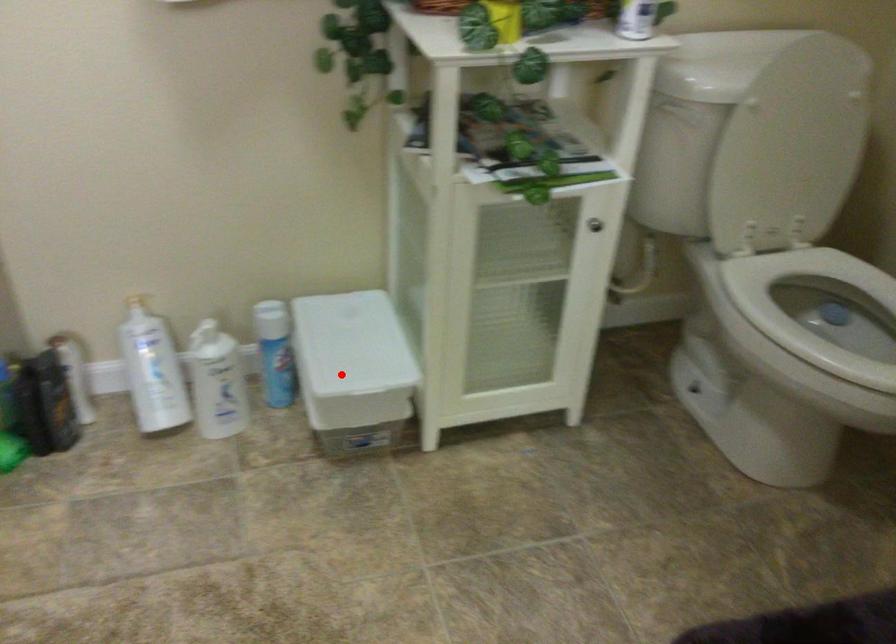
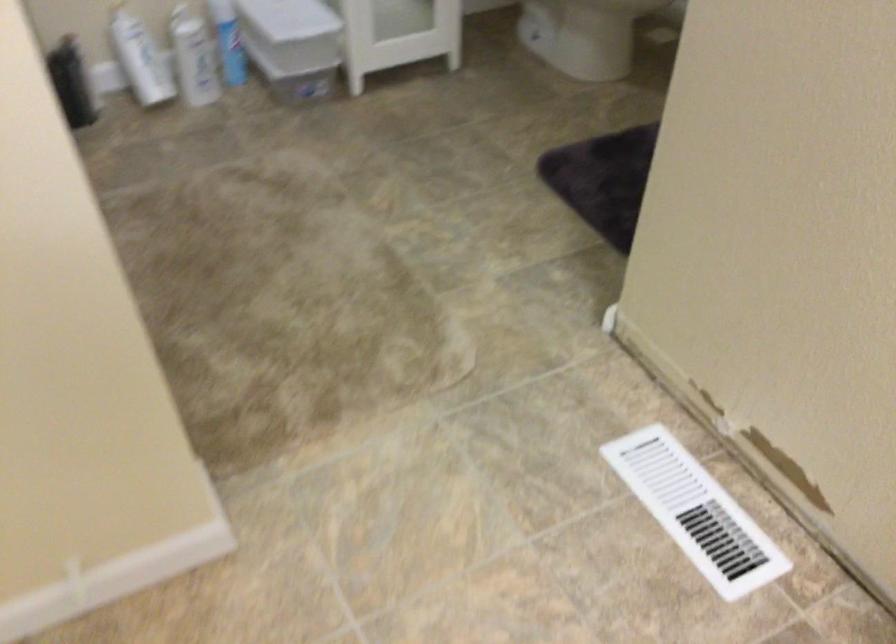
Question: I am providing you with two images of the same scene from different viewpoints. A red point is marked on the first image. At the location where the point appears in image 1, is it still visible in image 2?

Choices:
 (A) Yes
 (B) No

Answer: (A)